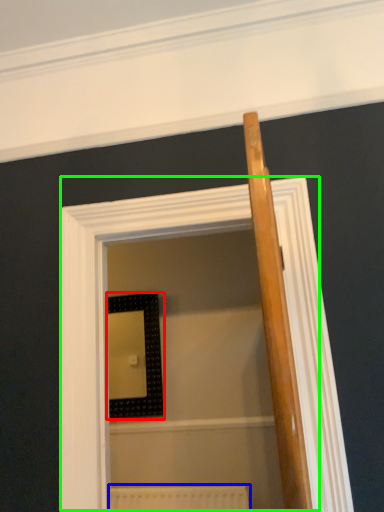
Question: Which is nearer to the picture frame (highlighted by a red box)? radiator (highlighted by a blue box) or screen door (highlighted by a green box).

Choices:
 (A) radiator
 (B) screen door

Answer: (A)